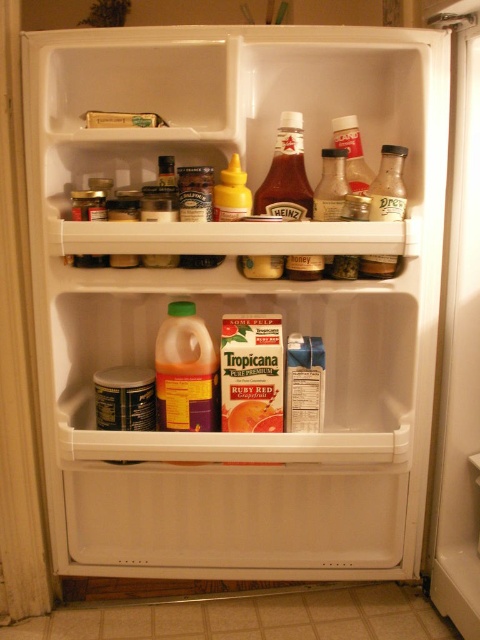
Is translucent glass bottle at upper right taller than translucent glass jar at upper center?

Indeed, translucent glass bottle at upper right has a greater height compared to translucent glass jar at upper center.

Who is more forward, (397, 154) or (355, 122)?

Point (397, 154) is more forward.

Identify the location of translucent glass bottle at upper right. (388, 186).

Is smooth glass bottle of heinz ketchup at center positioned before yellow matte mustard at upper center?

No, it is behind yellow matte mustard at upper center.

Locate an element on the screen. Image resolution: width=480 pixels, height=640 pixels. smooth glass bottle of heinz ketchup at center is located at coordinates (285, 188).

Image resolution: width=480 pixels, height=640 pixels. What do you see at coordinates (285, 188) in the screenshot?
I see `smooth glass bottle of heinz ketchup at center` at bounding box center [285, 188].

You are a GUI agent. You are given a task and a screenshot of the screen. Output one action in this format:
    pyautogui.click(x=<x>, y=<y>)
    Task: Click on the smooth glass bottle of heinz ketchup at center
    
    Given the screenshot: What is the action you would take?
    pyautogui.click(x=285, y=188)

Which is below, translucent glass bottle at upper right or translucent plastic bottle at upper center?

translucent glass bottle at upper right is below.

Between translucent glass bottle at upper right and translucent plastic bottle at upper center, which one has less height?

translucent plastic bottle at upper center is shorter.

Is point (385, 205) positioned in front of point (328, 195)?

Yes, it is in front of point (328, 195).

What are the coordinates of `translucent glass bottle at upper right` in the screenshot? It's located at pos(388,186).